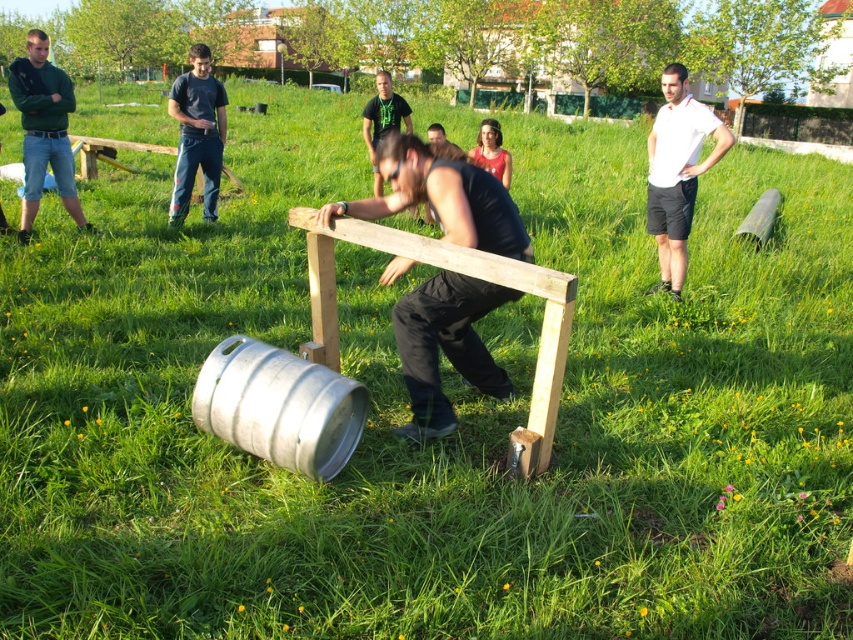
Between metallic silver squat at center and white cotton shirt at upper right, which one has less height?

metallic silver squat at center

Who is lower down, metallic silver squat at center or white cotton shirt at upper right?

metallic silver squat at center is lower down.

Measure the distance between metallic silver squat at center and camera.

metallic silver squat at center and camera are 11.35 feet apart from each other.

Image resolution: width=853 pixels, height=640 pixels. What are the coordinates of `metallic silver squat at center` in the screenshot? It's located at (445, 346).

Can you confirm if white cotton shirt at upper right is positioned above green matte shirt at upper left?

Incorrect, white cotton shirt at upper right is not positioned above green matte shirt at upper left.

Which of these two, white cotton shirt at upper right or green matte shirt at upper left, stands shorter?

Standing shorter between the two is green matte shirt at upper left.

Which is in front, point (671, 292) or point (53, 147)?

Point (671, 292) is in front.

Where is `white cotton shirt at upper right`? white cotton shirt at upper right is located at coordinates (677, 172).

Is metallic silver squat at center smaller than brushed metal shirt at upper left?

No, metallic silver squat at center is not smaller than brushed metal shirt at upper left.

Is point (451, 212) farther from camera compared to point (215, 193)?

No.

Measure the distance between metallic silver squat at center and camera.

metallic silver squat at center and camera are 3.46 meters apart.

Where is `metallic silver squat at center`? The image size is (853, 640). metallic silver squat at center is located at coordinates (445, 346).